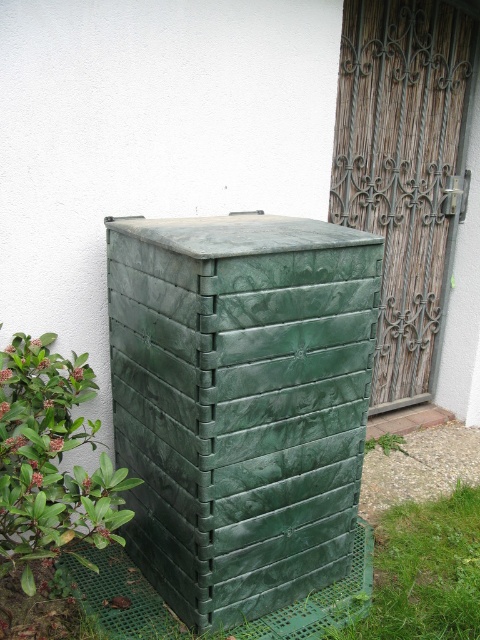
Identify the location of wooden textured door at right. The height and width of the screenshot is (640, 480). (406, 170).

Does wooden textured door at right have a lesser width compared to green grass at lower right?

Incorrect, wooden textured door at right's width is not less than green grass at lower right's.

Does point (436, 310) come farther from viewer compared to point (412, 509)?

Yes, point (436, 310) is behind point (412, 509).

At what (x,y) coordinates should I click in order to perform the action: click on wooden textured door at right. Please return your answer as a coordinate pair (x, y). Image resolution: width=480 pixels, height=640 pixels. Looking at the image, I should click on (406, 170).

Which is more to the right, green plastic crate at center or wooden textured door at right?

From the viewer's perspective, wooden textured door at right appears more on the right side.

Is point (358, 324) farther from camera compared to point (355, 152)?

No, it is not.

The width and height of the screenshot is (480, 640). What do you see at coordinates (240, 403) in the screenshot? I see `green plastic crate at center` at bounding box center [240, 403].

At what (x,y) coordinates should I click in order to perform the action: click on green plastic crate at center. Please return your answer as a coordinate pair (x, y). Image resolution: width=480 pixels, height=640 pixels. Looking at the image, I should click on (240, 403).

Which is in front, point (180, 611) or point (456, 554)?

Point (180, 611) is more forward.

This screenshot has width=480, height=640. What do you see at coordinates (240, 403) in the screenshot? I see `green plastic crate at center` at bounding box center [240, 403].

Locate an element on the screen. This screenshot has height=640, width=480. green plastic crate at center is located at coordinates (240, 403).